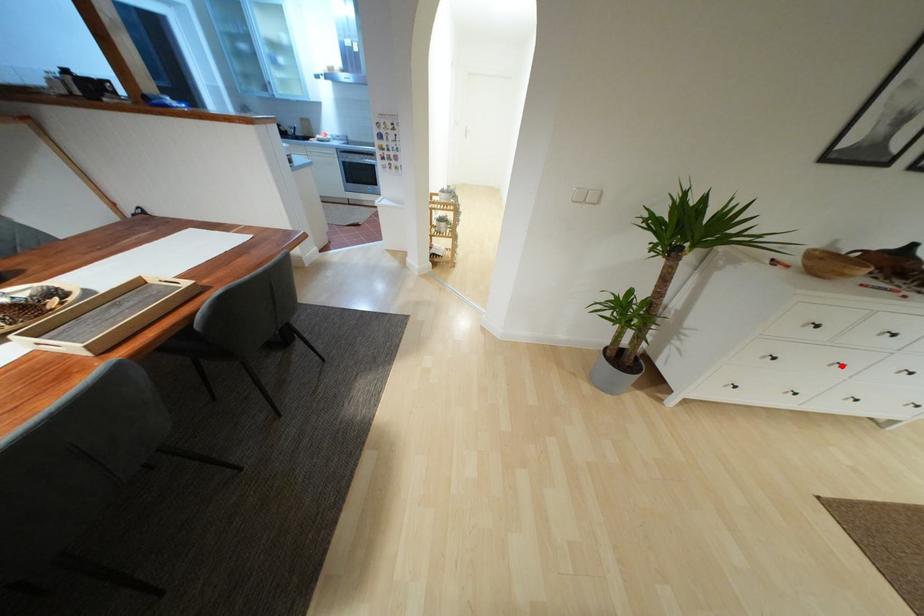
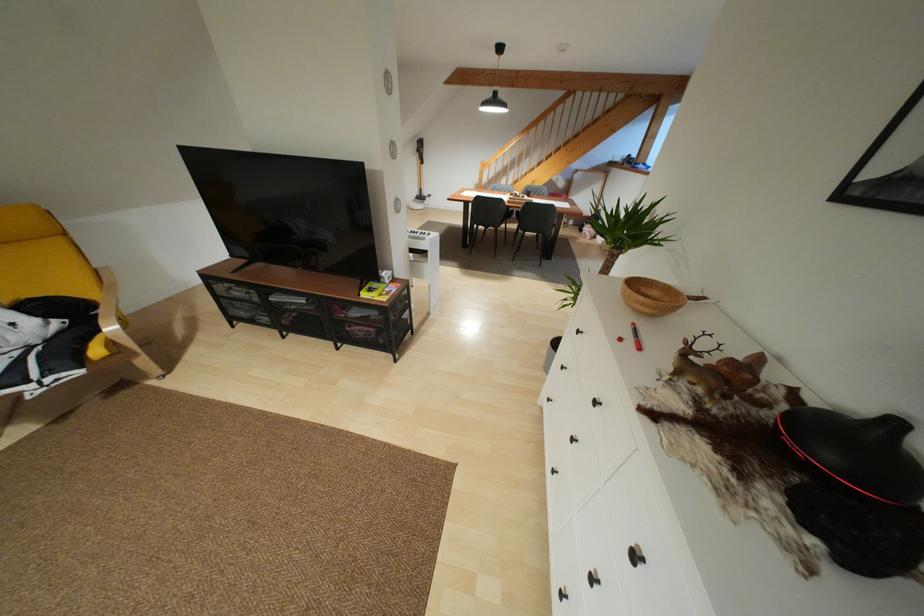
Question: I am providing you with two images of the same scene from different viewpoints. In image1, a red point is highlighted. Considering the same 3D point in image2, which of the following is correct?

Choices:
 (A) It is closer
 (B) It is farther

Answer: (A)